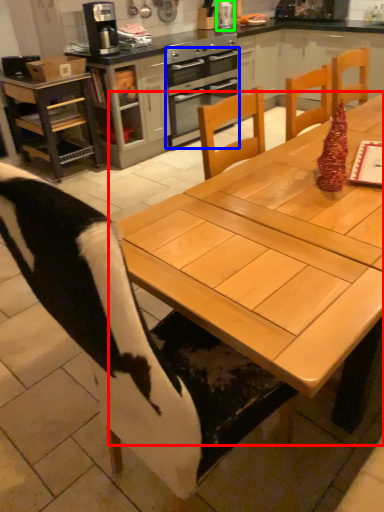
Question: Which object is positioned closest to table (highlighted by a red box)? Select from oven (highlighted by a blue box) and appliance (highlighted by a green box).

Choices:
 (A) oven
 (B) appliance

Answer: (A)